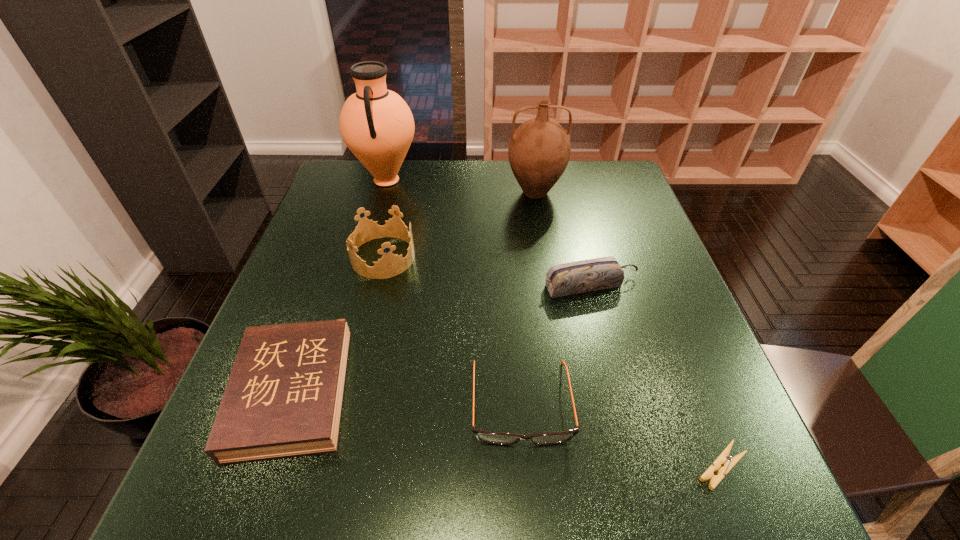
Find the location of a particular element. The height and width of the screenshot is (540, 960). vacant region located on the front-facing side of the tiara is located at coordinates coord(435,257).

I want to click on free space located on the front of the pencil box, so click(623, 413).

Where is `free region located on the back of the hardback book`? free region located on the back of the hardback book is located at coordinates (340, 257).

In order to click on vacant space located on the front-facing side of the spectacles in this screenshot , I will do `click(528, 500)`.

Find the location of `vacant position located 0.270m on the left of the shortest object`. vacant position located 0.270m on the left of the shortest object is located at coordinates (530, 467).

Locate an element on the screen. This screenshot has height=540, width=960. hardback book at the near edge is located at coordinates (284, 396).

Where is `clothespin at the near edge`? This screenshot has width=960, height=540. clothespin at the near edge is located at coordinates click(724, 457).

This screenshot has height=540, width=960. What are the coordinates of `pitcher that is at the left edge` in the screenshot? It's located at [x=376, y=124].

Locate an element on the screen. This screenshot has height=540, width=960. tiara that is at the left edge is located at coordinates (390, 265).

Identify the location of hardback book located in the left edge section of the desktop. This screenshot has height=540, width=960. (284, 396).